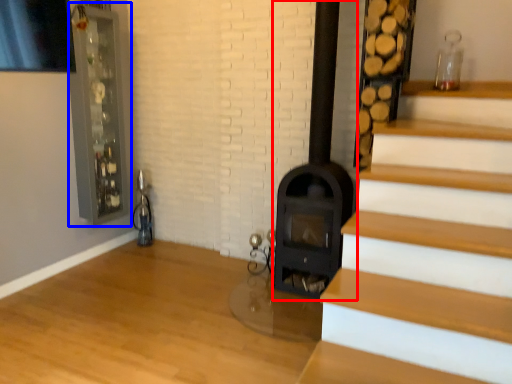
Question: Among these objects, which one is farthest to the camera, fireplace (highlighted by a red box) or glass door (highlighted by a blue box)?

Choices:
 (A) fireplace
 (B) glass door

Answer: (B)